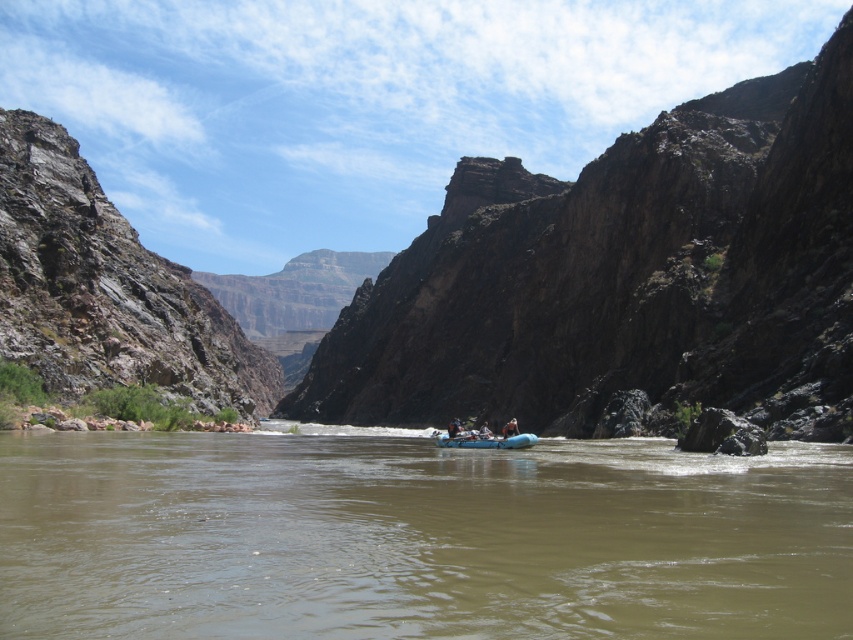
Question: Is brown rubber raft at center thinner than brown rocky canyon at center?

Choices:
 (A) no
 (B) yes

Answer: (B)

Question: Considering the real-world distances, which object is closest to the brown rocky canyon at center?

Choices:
 (A) blue rubber raft at center
 (B) brown rubber raft at center

Answer: (B)

Question: Does brown rubber raft at center appear under blue fabric raft at center?

Choices:
 (A) no
 (B) yes

Answer: (A)

Question: Which point is closer to the camera?

Choices:
 (A) blue fabric raft at center
 (B) brown rubber raft at center
 (C) blue rubber raft at center
 (D) brown rocky canyon at center

Answer: (B)

Question: Which object is the farthest from the blue rubber raft at center?

Choices:
 (A) brown rocky canyon at center
 (B) blue fabric raft at center
 (C) brown rubber raft at center

Answer: (A)

Question: Is brown rubber raft at center above brown rocky canyon at center?

Choices:
 (A) no
 (B) yes

Answer: (A)